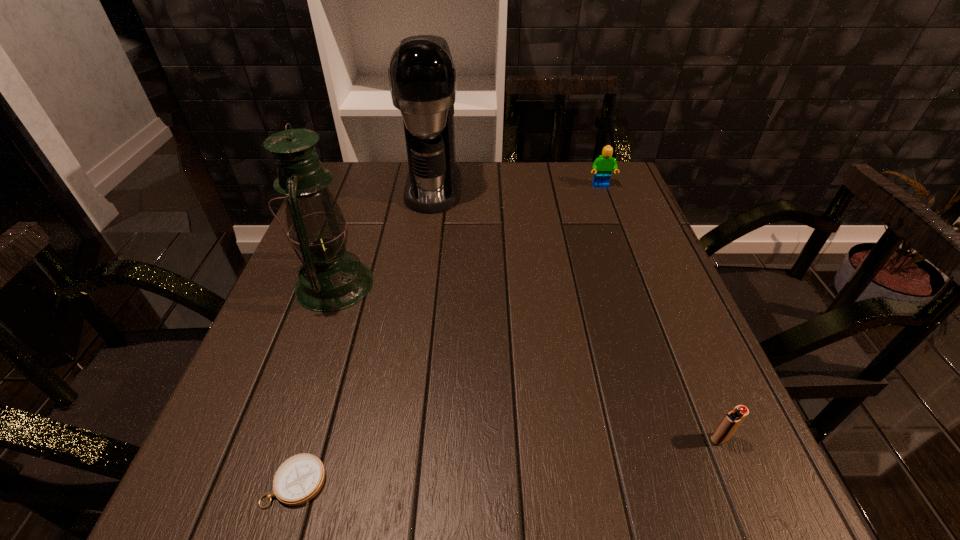
Locate an element on the screen. free space that satisfies the following two spatial constraints: 1. on the face of the second nearest object; 2. on the right side of the third tallest object is located at coordinates (696, 439).

Locate an element on the screen. This screenshot has width=960, height=540. free space that satisfies the following two spatial constraints: 1. on the front side of the compass; 2. on the right side of the third nearest object is located at coordinates click(x=266, y=482).